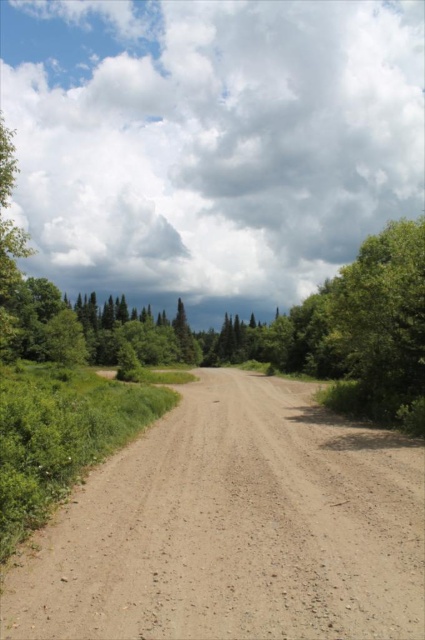
Question: Does brown gravel dirt track at center have a larger size compared to green leafy tree at right?

Choices:
 (A) no
 (B) yes

Answer: (A)

Question: Which of the following is the closest to the observer?

Choices:
 (A) green leafy tree at right
 (B) brown gravel dirt track at center

Answer: (B)

Question: Which point appears closest to the camera in this image?

Choices:
 (A) click(410, 280)
 (B) click(260, 525)

Answer: (B)

Question: Does brown gravel dirt track at center appear over green leafy tree at right?

Choices:
 (A) no
 (B) yes

Answer: (A)

Question: Can you confirm if brown gravel dirt track at center is positioned to the right of green leafy tree at right?

Choices:
 (A) yes
 (B) no

Answer: (B)